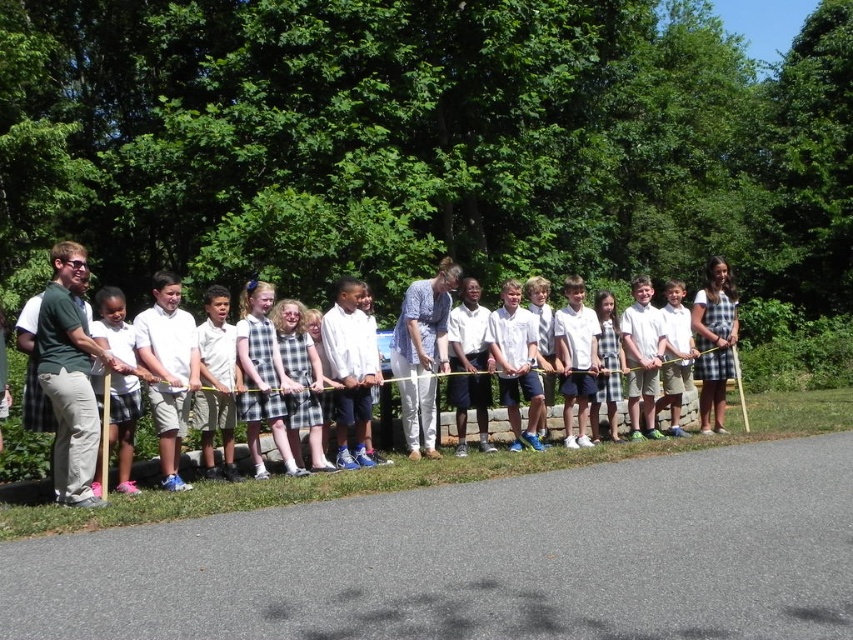
Question: Which of these objects is positioned farthest from the pink fabric dress at left?

Choices:
 (A) white cotton dress at center
 (B) plaid skirt at center

Answer: (B)

Question: Which point appears closest to the camera in this image?

Choices:
 (A) (119, 323)
 (B) (596, 296)
 (C) (85, 456)

Answer: (C)

Question: Can you confirm if pink fabric dress at left is positioned below white cotton dress at center?

Choices:
 (A) no
 (B) yes

Answer: (A)

Question: Is pink fabric dress at left above plaid skirt at center?

Choices:
 (A) no
 (B) yes

Answer: (A)

Question: Which object appears farthest from the camera in this image?

Choices:
 (A) plaid skirt at center
 (B) white cotton dress at center
 (C) pink fabric dress at left

Answer: (A)

Question: Where is pink fabric dress at left located in relation to plaid skirt at center in the image?

Choices:
 (A) below
 (B) above

Answer: (A)